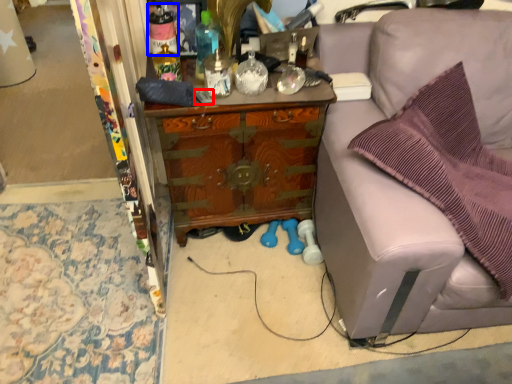
Question: Among these objects, which one is farthest to the camera, remote control (highlighted by a red box) or bottle (highlighted by a blue box)?

Choices:
 (A) remote control
 (B) bottle

Answer: (A)